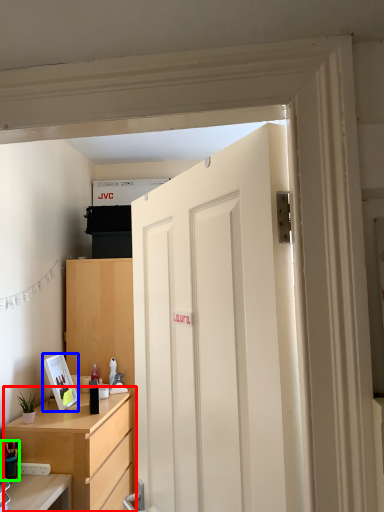
Question: Estimate the real-world distances between objects in this image. Which object is farther from cabinetry (highlighted by a red box), picture frame (highlighted by a blue box) or stationery (highlighted by a green box)?

Choices:
 (A) picture frame
 (B) stationery

Answer: (B)